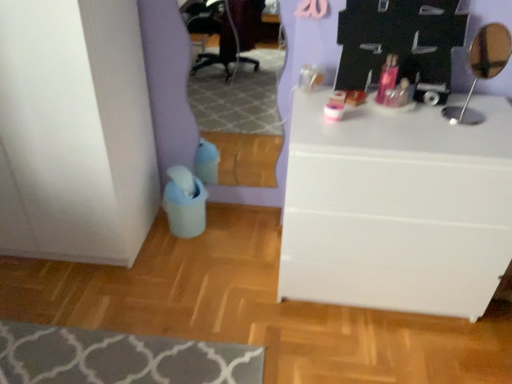
Measure the distance between point (485, 53) and camera.

The distance of point (485, 53) from camera is 1.62 meters.

At what (x,y) coordinates should I click in order to perform the action: click on gray textured rug at lower left. Please return your answer as a coordinate pair (x, y). Looking at the image, I should click on (119, 358).

Find the location of a particular element. This screenshot has height=384, width=512. metallic silver mirror at upper right is located at coordinates pos(482,68).

Is metallic silver mirror at upper right aimed at white matte chest of drawers at center?

No, metallic silver mirror at upper right is not facing towards white matte chest of drawers at center.

Is metallic silver mirror at upper right wider than white matte chest of drawers at center?

In fact, metallic silver mirror at upper right might be narrower than white matte chest of drawers at center.

Is metallic silver mirror at upper right at the right side of white matte chest of drawers at center?

Correct, you'll find metallic silver mirror at upper right to the right of white matte chest of drawers at center.

From the image's perspective, which one is positioned higher, metallic silver mirror at upper right or white matte chest of drawers at center?

metallic silver mirror at upper right, from the image's perspective.

Is white matte chest of drawers at center positioned with its back to gray textured rug at lower left?

No, white matte chest of drawers at center is not facing the opposite direction of gray textured rug at lower left.

Can you confirm if white matte chest of drawers at center is smaller than gray textured rug at lower left?

No, white matte chest of drawers at center is not smaller than gray textured rug at lower left.

Based on the photo, in terms of height, does white matte chest of drawers at center look taller or shorter compared to gray textured rug at lower left?

Clearly, white matte chest of drawers at center is taller compared to gray textured rug at lower left.

Is white matte chest of drawers at center wider than gray textured rug at lower left?

Incorrect, the width of white matte chest of drawers at center does not surpass that of gray textured rug at lower left.

Is gray textured rug at lower left spatially inside white matte chest of drawers at center, or outside of it?

gray textured rug at lower left is not inside white matte chest of drawers at center, it's outside.

Considering the relative sizes of gray textured rug at lower left and white matte chest of drawers at center in the image provided, is gray textured rug at lower left bigger than white matte chest of drawers at center?

Incorrect, gray textured rug at lower left is not larger than white matte chest of drawers at center.

From the image's perspective, which is above, gray textured rug at lower left or white matte chest of drawers at center?

white matte chest of drawers at center.

In the scene shown: Between gray textured rug at lower left and metallic silver mirror at upper right, which one has more height?

metallic silver mirror at upper right is taller.

Measure the distance from gray textured rug at lower left to metallic silver mirror at upper right.

gray textured rug at lower left is 1.43 meters from metallic silver mirror at upper right.

Considering the sizes of objects gray textured rug at lower left and metallic silver mirror at upper right in the image provided, who is bigger, gray textured rug at lower left or metallic silver mirror at upper right?

gray textured rug at lower left is bigger.

Which is further, (494, 55) or (217, 359)?

Positioned behind is point (494, 55).

Looking at their sizes, would you say metallic silver mirror at upper right is wider or thinner than gray textured rug at lower left?

Clearly, metallic silver mirror at upper right has less width compared to gray textured rug at lower left.

In the scene shown: Is metallic silver mirror at upper right inside the boundaries of gray textured rug at lower left, or outside?

metallic silver mirror at upper right exists outside the volume of gray textured rug at lower left.

Could you tell me if metallic silver mirror at upper right is turned towards gray textured rug at lower left?

No, metallic silver mirror at upper right is not turned towards gray textured rug at lower left.

Is white matte chest of drawers at center to the right of metallic silver mirror at upper right from the viewer's perspective?

No, white matte chest of drawers at center is not to the right of metallic silver mirror at upper right.

Is point (473, 275) positioned after point (495, 59)?

No, it is in front of (495, 59).

Who is bigger, white matte chest of drawers at center or metallic silver mirror at upper right?

Bigger between the two is white matte chest of drawers at center.

From a real-world perspective, is white matte chest of drawers at center physically located above or below metallic silver mirror at upper right?

white matte chest of drawers at center is situated lower than metallic silver mirror at upper right in the real world.

Find the location of a particular element. The width and height of the screenshot is (512, 384). mirror above the white matte chest of drawers at center (from a real-world perspective) is located at coordinates (482, 68).

In the image, there is a gray textured rug at lower left. Find the location of `the chest of drawers above it (from the image's perspective)`. the chest of drawers above it (from the image's perspective) is located at coordinates (397, 208).

Looking at the image, which one is located further to metallic silver mirror at upper right, gray textured rug at lower left or white matte chest of drawers at center?

gray textured rug at lower left is further to metallic silver mirror at upper right.

Looking at the image, which one is located closer to white matte chest of drawers at center, gray textured rug at lower left or metallic silver mirror at upper right?

The object closer to white matte chest of drawers at center is metallic silver mirror at upper right.

Based on their spatial positions, is metallic silver mirror at upper right or gray textured rug at lower left closer to white matte chest of drawers at center?

The object closer to white matte chest of drawers at center is metallic silver mirror at upper right.

When comparing their distances from gray textured rug at lower left, does white matte chest of drawers at center or metallic silver mirror at upper right seem further?

metallic silver mirror at upper right is positioned further to the anchor gray textured rug at lower left.

Considering their positions, is white matte chest of drawers at center positioned closer to metallic silver mirror at upper right than gray textured rug at lower left?

white matte chest of drawers at center lies closer to metallic silver mirror at upper right than the other object.

Estimate the real-world distances between objects in this image. Which object is closer to gray textured rug at lower left, metallic silver mirror at upper right or white matte chest of drawers at center?

The object closer to gray textured rug at lower left is white matte chest of drawers at center.

Identify the location of chest of drawers between gray textured rug at lower left and metallic silver mirror at upper right in the horizontal direction. This screenshot has height=384, width=512. (397, 208).